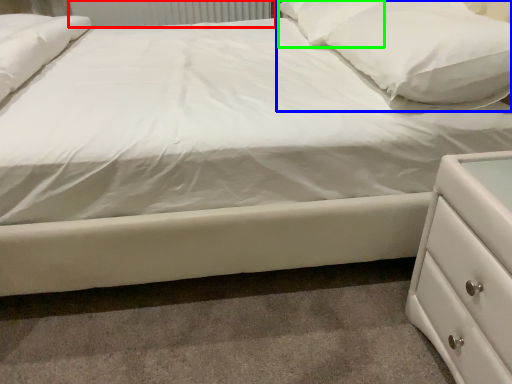
Question: Which is farther away from radiator (highlighted by a red box)? pillow (highlighted by a blue box) or pillow (highlighted by a green box)?

Choices:
 (A) pillow
 (B) pillow

Answer: (A)